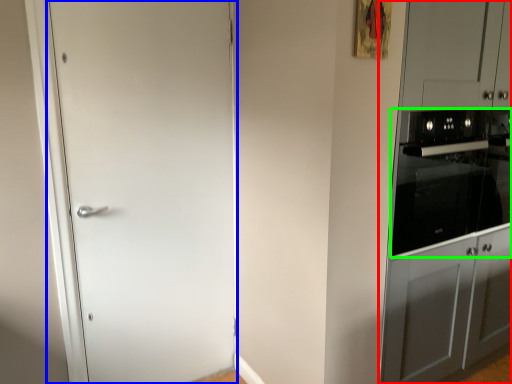
Question: Which is farther away from dresser (highlighted by a red box)? door (highlighted by a blue box) or home appliance (highlighted by a green box)?

Choices:
 (A) door
 (B) home appliance

Answer: (A)